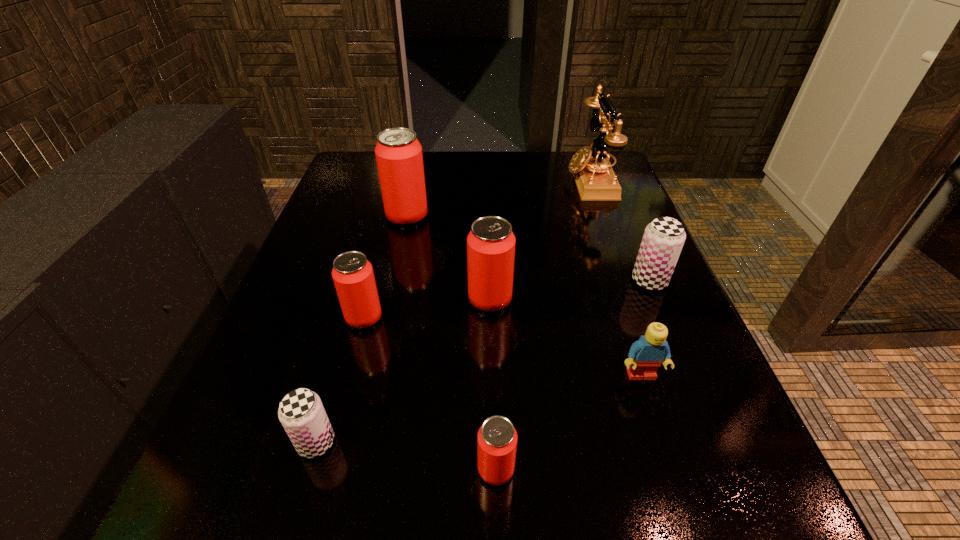
Locate an element on the screen. free spot between the nearest red beer can and the beige telephone is located at coordinates (542, 325).

Where is `blank region between the third smallest red beer can and the smallest red beer can`? The image size is (960, 540). blank region between the third smallest red beer can and the smallest red beer can is located at coordinates (492, 384).

Find the location of a particular element. Image resolution: width=960 pixels, height=540 pixels. free space that is in between the farther purple beer can and the left purple beer can is located at coordinates (483, 362).

The image size is (960, 540). In order to click on vacant area that lies between the smallest red beer can and the third smallest red beer can in this screenshot , I will do tap(492, 384).

Find the location of `object that is the second closest to the tallest beer can`. object that is the second closest to the tallest beer can is located at coordinates (352, 273).

Identify the location of the fifth closest object to the farthest red beer can. (301, 412).

This screenshot has height=540, width=960. In order to click on the closest beer can to the smallest red beer can in this screenshot , I will do click(x=301, y=412).

Locate an element on the screen. Image resolution: width=960 pixels, height=540 pixels. beer can that is the fifth closest to the bigger purple beer can is located at coordinates (301, 412).

Choose which red beer can is the third nearest neighbor to the farthest beer can. Please provide its 2D coordinates. Your answer should be formatted as a tuple, i.e. [(x, y)], where the tuple contains the x and y coordinates of a point satisfying the conditions above.

[(497, 438)]

Where is `red beer can that can be found as the third closest to the smallest red beer can`? red beer can that can be found as the third closest to the smallest red beer can is located at coordinates (399, 158).